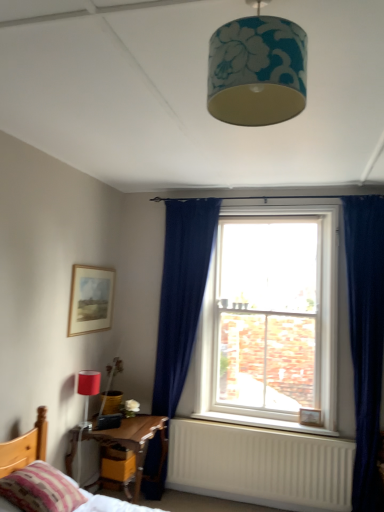
Where is `wooden bed at lower left`? wooden bed at lower left is located at coordinates (58, 492).

This screenshot has width=384, height=512. Describe the element at coordinates (58, 492) in the screenshot. I see `wooden bed at lower left` at that location.

The height and width of the screenshot is (512, 384). I want to click on matte gold picture frame at upper left, the second picture frame positioned from the right, so click(x=90, y=298).

At what (x,y) coordinates should I click in order to perform the action: click on white painted wood at lower center. Please return your answer as a coordinate pair (x, y). The width and height of the screenshot is (384, 512). Looking at the image, I should click on (262, 423).

From the picture: Which of these two, yellow wood drawer at lower left or matte gold picture frame at upper left, which is the first picture frame from left to right, is wider?

yellow wood drawer at lower left.

From a real-world perspective, is yellow wood drawer at lower left under matte gold picture frame at upper left, acting as the first picture frame starting from the top?

Correct, in the physical world, yellow wood drawer at lower left is lower than matte gold picture frame at upper left, acting as the first picture frame starting from the top.

This screenshot has height=512, width=384. I want to click on drawer behind the matte gold picture frame at upper left, which appears as the second picture frame when ordered from the bottom, so click(118, 469).

Would you say white painted wood at lower center is a long distance from striped fabric pillow at lower left?

Yes.

The image size is (384, 512). What are the coordinates of `pillow above the white painted wood at lower center (from the image's perspective)` in the screenshot? It's located at (41, 489).

Does white painted wood at lower center lie in front of striped fabric pillow at lower left?

That is False.

From the image's perspective, between white painted wood at lower center and striped fabric pillow at lower left, which one is located above?

striped fabric pillow at lower left appears higher in the image.

Is matte red lampshade at lower left, which is counted as the 1th lamp, starting from the left, positioned behind striped fabric pillow at lower left?

Yes.

Between matte red lampshade at lower left, the 2th lamp in the top-to-bottom sequence, and striped fabric pillow at lower left, which one appears on the left side from the viewer's perspective?

matte red lampshade at lower left, the 2th lamp in the top-to-bottom sequence, is more to the left.

From a real-world perspective, which object rests below the other?

striped fabric pillow at lower left is physically lower.

Is matte red lampshade at lower left, which is counted as the 1th lamp, starting from the left, with striped fabric pillow at lower left?

No, matte red lampshade at lower left, which is counted as the 1th lamp, starting from the left, is not in contact with striped fabric pillow at lower left.

From a real-world perspective, which is physically above, yellow wood drawer at lower left or striped fabric pillow at lower left?

striped fabric pillow at lower left is physically above.

Consider the image. Which point is more forward, (132, 454) or (24, 501)?

The point (24, 501) is closer.

How different are the orientations of yellow wood drawer at lower left and striped fabric pillow at lower left in degrees?

0.74 degrees.

Identify the location of drawer behind the striped fabric pillow at lower left. The width and height of the screenshot is (384, 512). (118, 469).

Measure the distance between striped fabric pillow at lower left and white painted wood at lower center.

A distance of 1.74 meters exists between striped fabric pillow at lower left and white painted wood at lower center.

From a real-world perspective, who is located higher, striped fabric pillow at lower left or white painted wood at lower center?

striped fabric pillow at lower left is physically above.

Between striped fabric pillow at lower left and white painted wood at lower center, which one has smaller size?

Smaller between the two is white painted wood at lower center.

Is striped fabric pillow at lower left taller than white painted wood at lower center?

Yes.

Considering the positions of objects wooden bed at lower left and matte red lampshade at lower left, the 2th lamp in the top-to-bottom sequence, in the image provided, who is in front, wooden bed at lower left or matte red lampshade at lower left, the 2th lamp in the top-to-bottom sequence,?

wooden bed at lower left is in front.

Consider the image. In terms of width, does wooden bed at lower left look wider or thinner when compared to matte red lampshade at lower left, the 1th lamp from the bottom?

Considering their sizes, wooden bed at lower left looks broader than matte red lampshade at lower left, the 1th lamp from the bottom.

Is wooden bed at lower left located outside matte red lampshade at lower left, which is the 2th lamp in front-to-back order?

wooden bed at lower left is positioned outside matte red lampshade at lower left, which is the 2th lamp in front-to-back order.

Is wooden bed at lower left smaller than yellow wood drawer at lower left?

Incorrect, wooden bed at lower left is not smaller in size than yellow wood drawer at lower left.

From the image's perspective, relative to yellow wood drawer at lower left, is wooden bed at lower left above or below?

Clearly, from the image's perspective, wooden bed at lower left is below yellow wood drawer at lower left.

Is wooden bed at lower left looking in the opposite direction of yellow wood drawer at lower left?

Correct, wooden bed at lower left is looking away from yellow wood drawer at lower left.

Where is `bed that appears below the yellow wood drawer at lower left (from a real-world perspective)`? This screenshot has height=512, width=384. bed that appears below the yellow wood drawer at lower left (from a real-world perspective) is located at coordinates click(58, 492).

I want to click on picture frame lying on the left of yellow wood drawer at lower left, so click(90, 298).

You are a GUI agent. You are given a task and a screenshot of the screen. Output one action in this format:
    pyautogui.click(x=<x>, y=<y>)
    Task: Click on the window sill on the right of striped fabric pillow at lower left
    
    Given the screenshot: What is the action you would take?
    pyautogui.click(x=262, y=423)

Looking at the image, which one is located further to matte gold picture frame at upper left, acting as the first picture frame starting from the top, matte red lampshade at lower left, the 2th lamp in the top-to-bottom sequence, or yellow wood drawer at lower left?

yellow wood drawer at lower left is further to matte gold picture frame at upper left, acting as the first picture frame starting from the top.

Looking at the image, which one is located closer to striped fabric pillow at lower left, white painted wood at lower center or matte gold picture frame at upper left, which is the first picture frame from left to right?

matte gold picture frame at upper left, which is the first picture frame from left to right.

When comparing their distances from white painted wood at lower center, does teal floral fabric lampshade at upper center, the first lamp when ordered from top to bottom, or wooden picture frame at lower right, the 1th picture frame from the right, seem closer?

wooden picture frame at lower right, the 1th picture frame from the right, is positioned closer to the anchor white painted wood at lower center.

From the picture: Looking at the image, which one is located closer to teal floral fabric lampshade at upper center, which is the 1th lamp from right to left, wooden picture frame at lower right, the 1th picture frame from the right, or matte gold picture frame at upper left, which appears as the second picture frame when ordered from the bottom?

Among the two, matte gold picture frame at upper left, which appears as the second picture frame when ordered from the bottom, is located nearer to teal floral fabric lampshade at upper center, which is the 1th lamp from right to left.

Estimate the real-world distances between objects in this image. Which object is further from teal floral fabric lampshade at upper center, acting as the 2th lamp starting from the back, striped fabric pillow at lower left or wooden picture frame at lower right, the first picture frame from the back?

wooden picture frame at lower right, the first picture frame from the back, is further to teal floral fabric lampshade at upper center, acting as the 2th lamp starting from the back.

Looking at the image, which one is located closer to matte gold picture frame at upper left, which appears as the second picture frame when ordered from the bottom, white painted wood at lower center or wooden picture frame at lower right, the 1th picture frame from the right?

white painted wood at lower center.

Which object lies further to the anchor point wooden picture frame at lower right, which ranks as the second picture frame in left-to-right order, white painted wood at lower center or striped fabric pillow at lower left?

striped fabric pillow at lower left.

Looking at the image, which one is located further to matte red lampshade at lower left, which is the 2th lamp in front-to-back order, wooden bed at lower left or teal floral fabric lampshade at upper center, positioned as the second lamp in bottom-to-top order?

teal floral fabric lampshade at upper center, positioned as the second lamp in bottom-to-top order.

Find the location of a particular element. drawer between matte red lampshade at lower left, which is the 2th lamp in front-to-back order, and wooden bed at lower left vertically is located at coordinates (118, 469).

Locate an element on the screen. The width and height of the screenshot is (384, 512). pillow between teal floral fabric lampshade at upper center, the first lamp when ordered from top to bottom, and white painted wood at lower center, along the z-axis is located at coordinates (41, 489).

Where is `drawer situated between matte gold picture frame at upper left, which is the first picture frame from front to back, and white painted wood at lower center from left to right`? This screenshot has width=384, height=512. drawer situated between matte gold picture frame at upper left, which is the first picture frame from front to back, and white painted wood at lower center from left to right is located at coordinates 118,469.

At what (x,y) coordinates should I click in order to perform the action: click on drawer between matte gold picture frame at upper left, which appears as the second picture frame when ordered from the bottom, and clear glass window at center from left to right. Please return your answer as a coordinate pair (x, y). Image resolution: width=384 pixels, height=512 pixels. Looking at the image, I should click on (118, 469).